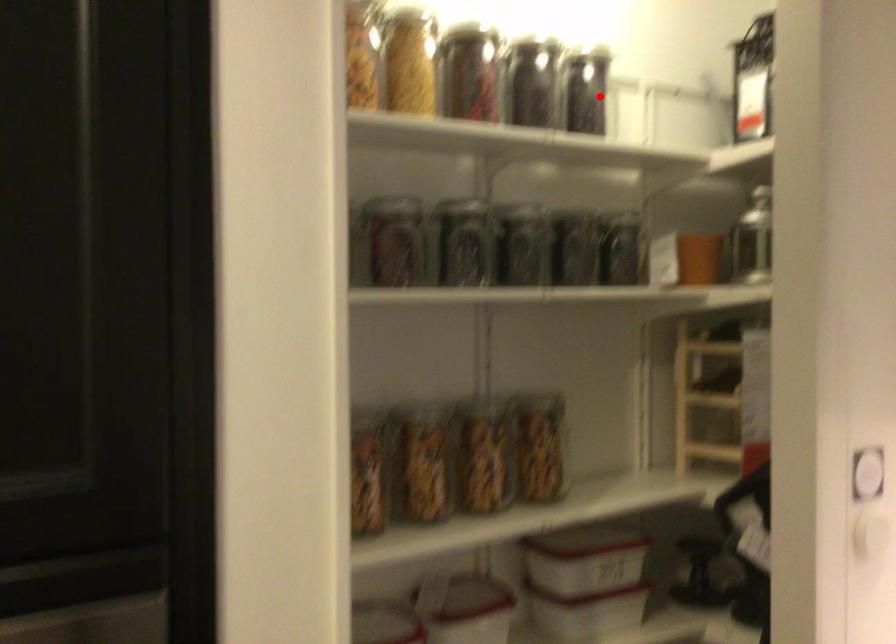
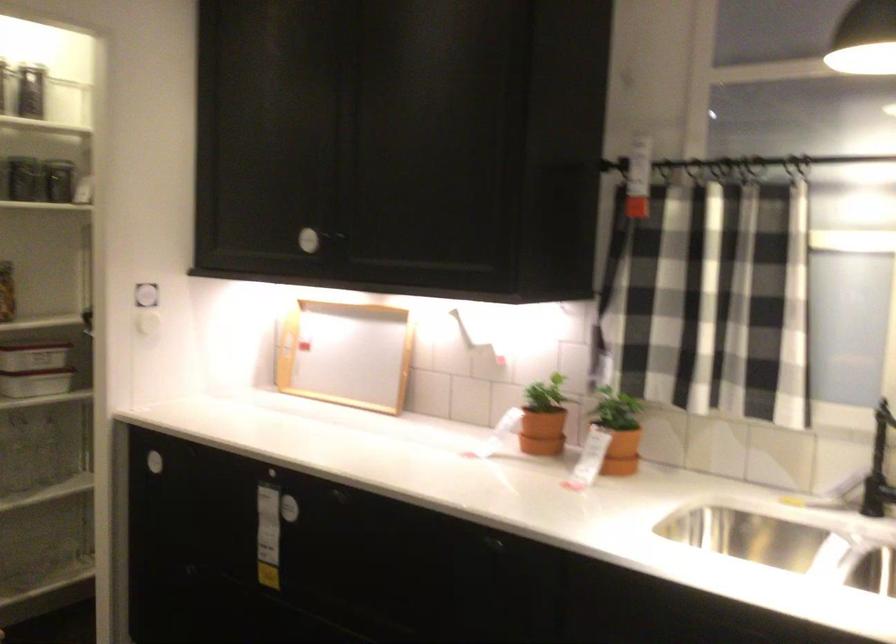
Question: I am providing you with two images of the same scene from different viewpoints. Image1 has a red point marked. In image2, the corresponding 3D location appears at what relative position? Reply with the corresponding letter.

Choices:
 (A) Closer
 (B) Farther

Answer: (B)